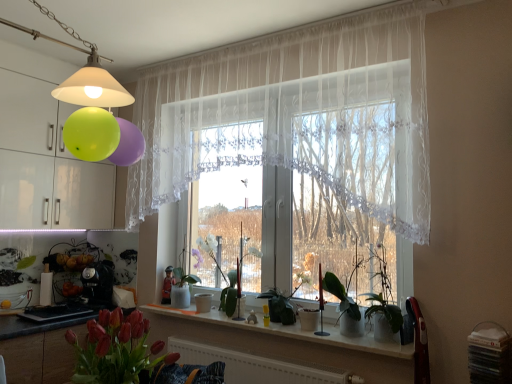
You are a GUI agent. You are given a task and a screenshot of the screen. Output one action in this format:
    pyautogui.click(x=<x>, y=<y>)
    Task: Click on the free point above white sheer curtain at center (from a real-world perspective)
    
    Given the screenshot: What is the action you would take?
    pyautogui.click(x=238, y=37)